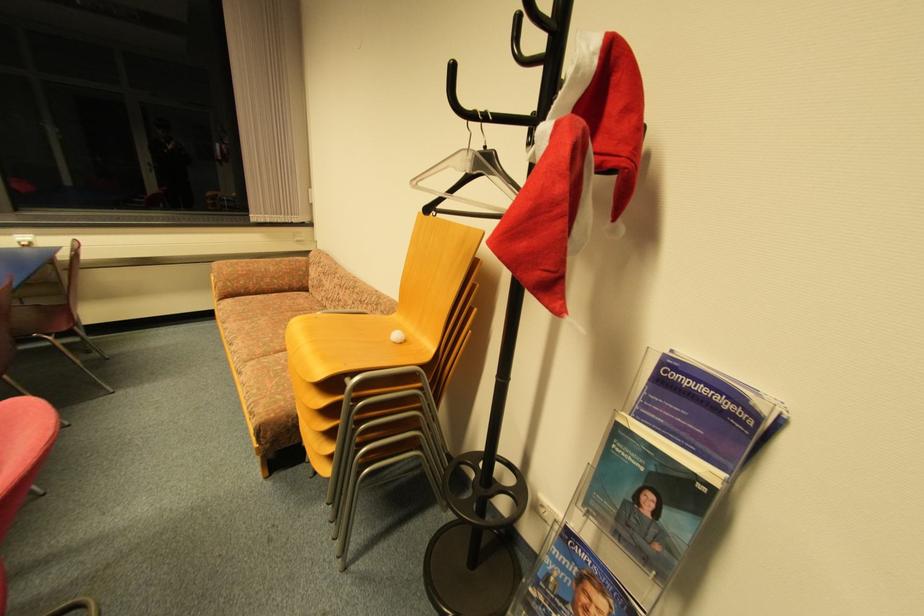
The image size is (924, 616). What do you see at coordinates (525, 65) in the screenshot?
I see `the black coat hook` at bounding box center [525, 65].